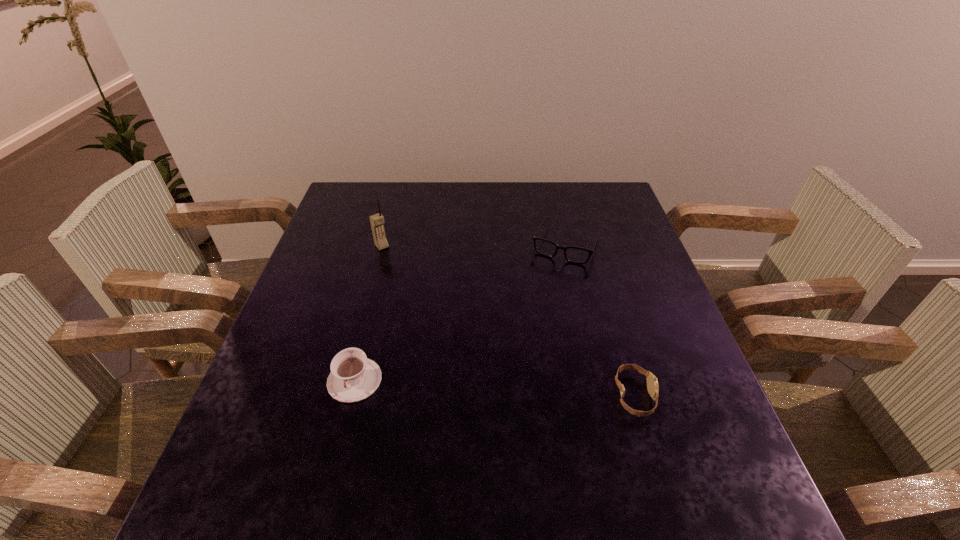
Identify the location of vacant area in the image that satisfies the following two spatial constraints: 1. on the front side of the shortest object; 2. on the face of the spectacles. (601, 396).

Where is `free point that satisfies the following two spatial constraints: 1. on the front side of the cellular telephone; 2. on the face of the shortest object`? The width and height of the screenshot is (960, 540). free point that satisfies the following two spatial constraints: 1. on the front side of the cellular telephone; 2. on the face of the shortest object is located at coordinates [342, 396].